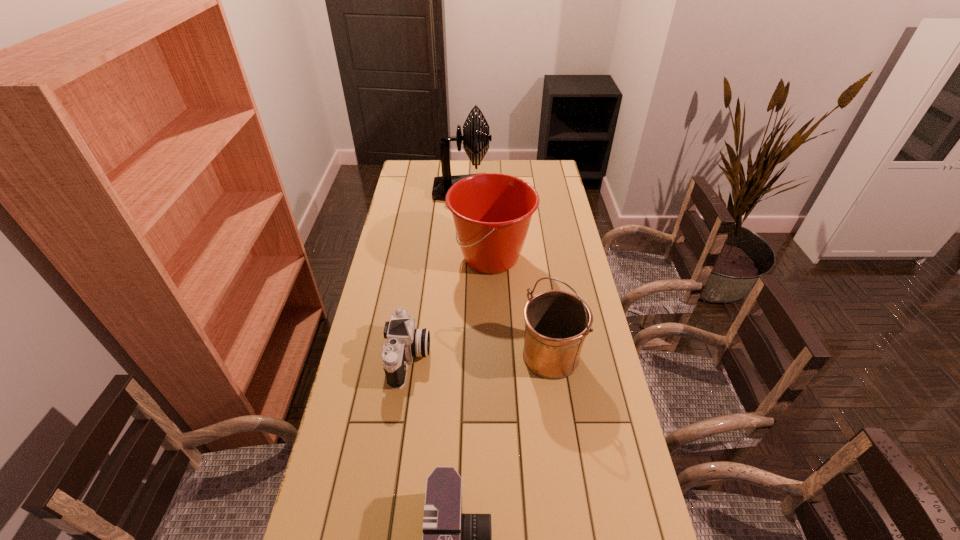
Identify the location of vacant space located on the front of the farther camera. This screenshot has height=540, width=960. (384, 531).

Find the location of `object present at the far edge`. object present at the far edge is located at coordinates (473, 138).

This screenshot has height=540, width=960. Identify the location of object at the left edge. (404, 342).

You are a GUI agent. You are given a task and a screenshot of the screen. Output one action in this format:
    pyautogui.click(x=<x>, y=<y>)
    Task: Click on the object located at the right edge
    The width and height of the screenshot is (960, 540).
    Given the screenshot: What is the action you would take?
    pyautogui.click(x=557, y=322)

Image resolution: width=960 pixels, height=540 pixels. What are the coordinates of `blank space at the left edge of the desktop` in the screenshot? It's located at pyautogui.click(x=407, y=241).

Locate an element on the screen. The height and width of the screenshot is (540, 960). free spot at the right edge of the desktop is located at coordinates (569, 227).

This screenshot has width=960, height=540. I want to click on free location at the far left corner of the desktop, so click(429, 177).

This screenshot has width=960, height=540. Identify the location of blank region between the farther camera and the fourth nearest object. (450, 308).

Image resolution: width=960 pixels, height=540 pixels. What are the coordinates of `free space between the nearer bucket and the farther bucket` in the screenshot? It's located at (521, 307).

At what (x,y) coordinates should I click in order to perform the action: click on empty space that is in between the fan and the nearer bucket. Please return your answer as a coordinate pair (x, y). This screenshot has height=540, width=960. Looking at the image, I should click on (507, 274).